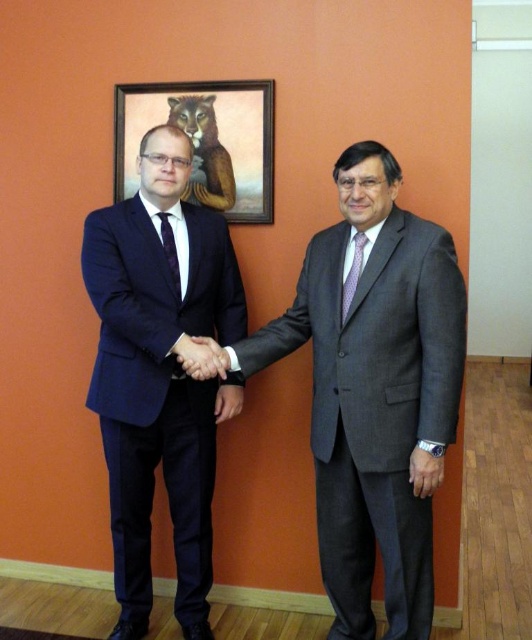
Question: Is matte black hand at center thinner than matte purple tie at center?

Choices:
 (A) no
 (B) yes

Answer: (A)

Question: Which object is the farthest from the purple silk tie at right?

Choices:
 (A) wooden frame at upper center
 (B) matte black hand at center

Answer: (A)

Question: Based on their relative distances, which object is nearer to the matte purple tie at center?

Choices:
 (A) purple silk tie at right
 (B) matte black hand at center

Answer: (B)

Question: Does navy blue suit at left appear over purple silk tie at right?

Choices:
 (A) no
 (B) yes

Answer: (A)

Question: Which point is farther from the camera taking this photo?

Choices:
 (A) (170, 189)
 (B) (336, 296)

Answer: (A)

Question: Is navy blue suit at left positioned behind matte black hand at center?

Choices:
 (A) yes
 (B) no

Answer: (A)